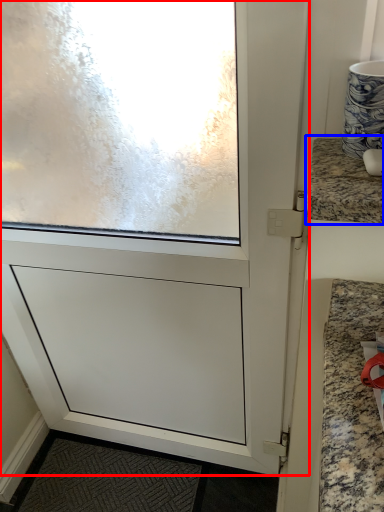
Question: Which object appears closest to the camera in this image, screen door (highlighted by a red box) or countertop (highlighted by a blue box)?

Choices:
 (A) screen door
 (B) countertop

Answer: (B)